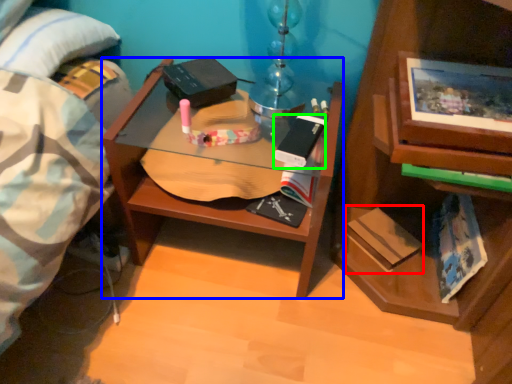
Question: Based on their relative distances, which object is nearer to paperback book (highlighted by a red box)? Choose from desk (highlighted by a blue box) and paperback book (highlighted by a green box).

Choices:
 (A) desk
 (B) paperback book

Answer: (B)